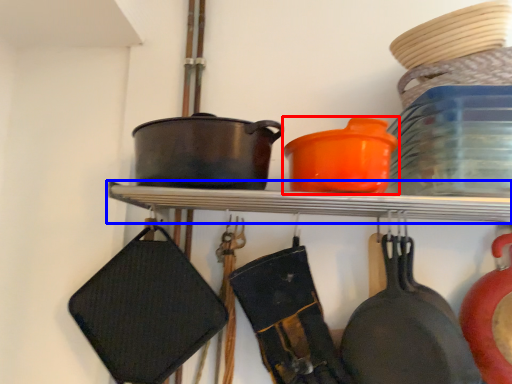
Question: Among these objects, which one is farthest to the camera, tableware (highlighted by a red box) or shelf (highlighted by a blue box)?

Choices:
 (A) tableware
 (B) shelf

Answer: (B)